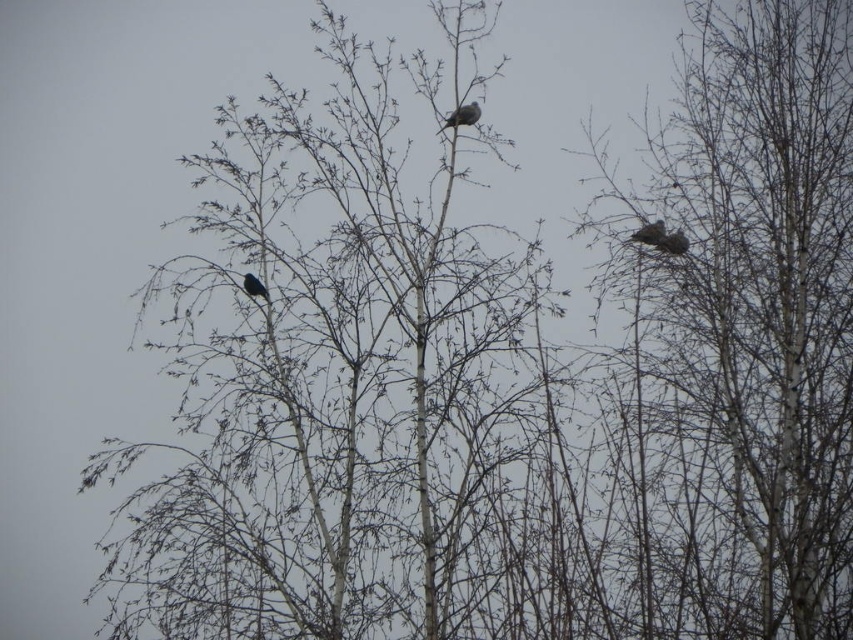
You are a birdwatcher observing the scene. You notice a brown fuzzy nest at upper right and a gray matte bird at upper center. Which object is smaller in size?

The brown fuzzy nest at upper right is smaller in size compared to the gray matte bird at upper center.

You are an ornithologist observing the scene. You notice a brown fuzzy nest at upper right and bare branches at upper center. Which object is positioned to the left of the other?

The bare branches at upper center are positioned to the right of the brown fuzzy nest at upper right, so the brown fuzzy nest at upper right is to the left of the bare branches at upper center.